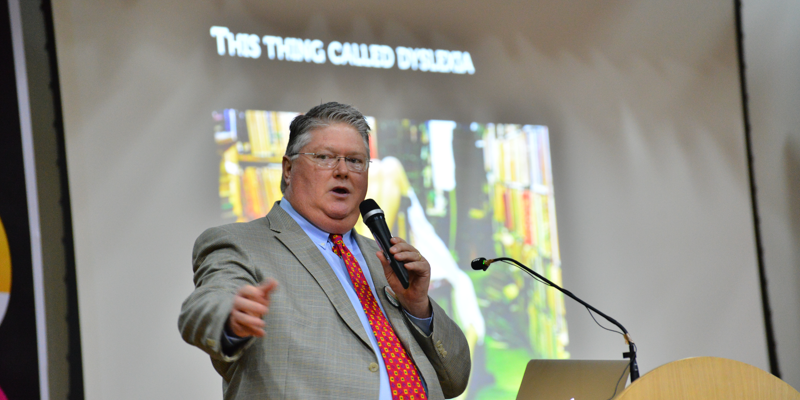
Find the location of a particular element. The width and height of the screenshot is (800, 400). screen is located at coordinates (633, 124).